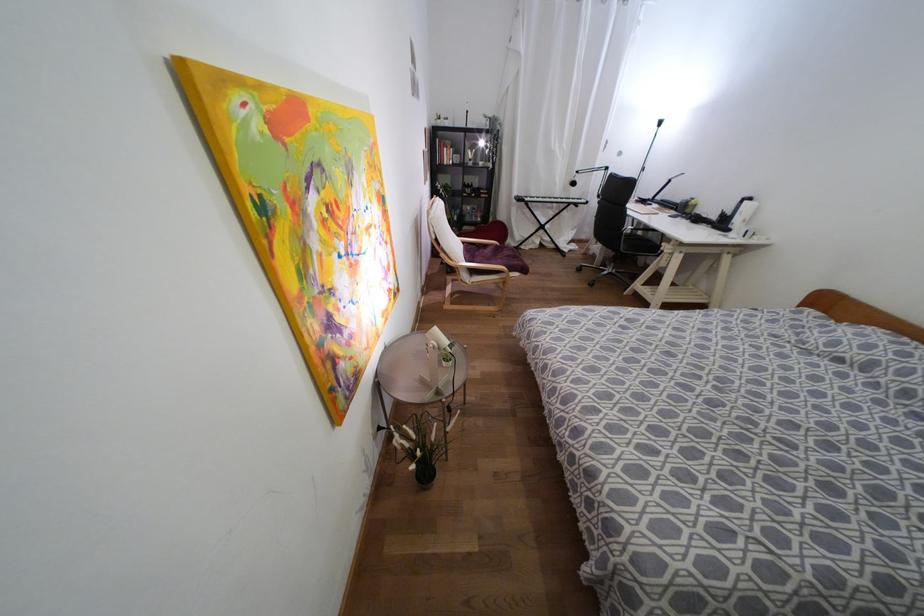
This screenshot has height=616, width=924. I want to click on white table lamp, so click(440, 339).